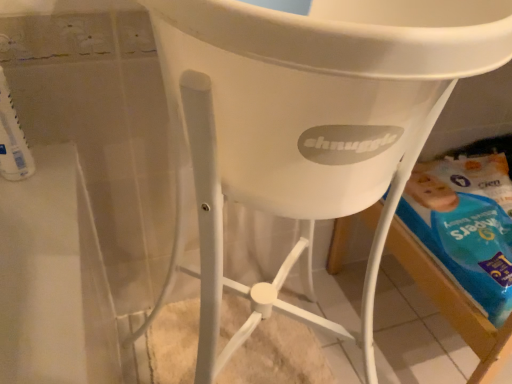
The width and height of the screenshot is (512, 384). Describe the element at coordinates (12, 139) in the screenshot. I see `white plastic toothbrush at left` at that location.

Find the location of a particular element. white plastic toothbrush at left is located at coordinates (12, 139).

Measure the distance between point (3, 149) and camera.

A distance of 29.21 inches exists between point (3, 149) and camera.

I want to click on white plastic toothbrush at left, so click(12, 139).